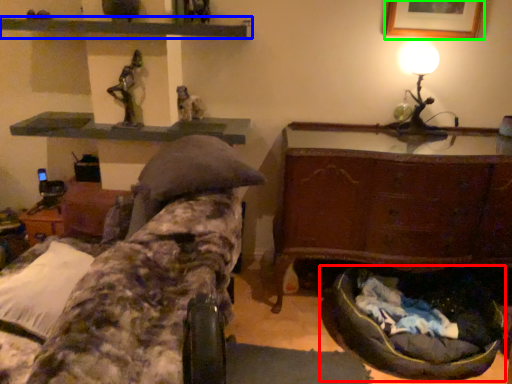
Question: Based on their relative distances, which object is farther from bean bag chair (highlighted by a red box)? Choose from shelf (highlighted by a blue box) and picture frame (highlighted by a green box).

Choices:
 (A) shelf
 (B) picture frame

Answer: (A)